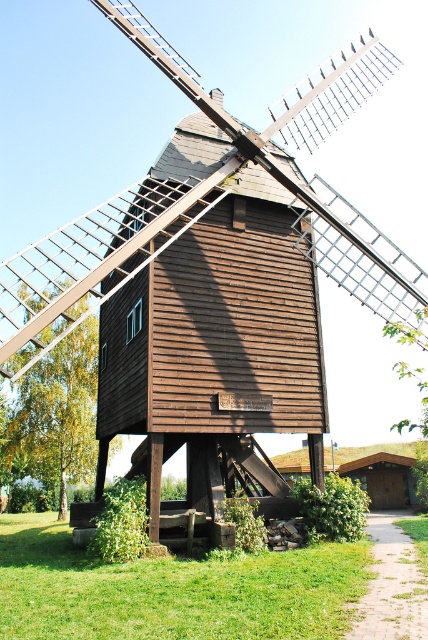
Question: Can you confirm if brown wooden hut at center is positioned above green grass at lower center?

Choices:
 (A) yes
 (B) no

Answer: (A)

Question: Observing the image, what is the correct spatial positioning of brown wooden windmill at center in reference to green grass at lower center?

Choices:
 (A) left
 (B) right

Answer: (B)

Question: Which object appears closest to the camera in this image?

Choices:
 (A) brown wooden windmill at center
 (B) brown wooden hut at center
 (C) brown wooden hut at lower right

Answer: (A)

Question: Does brown wooden windmill at center appear over brown wooden hut at lower right?

Choices:
 (A) yes
 (B) no

Answer: (A)

Question: Which point appears farthest from the camera in this image?

Choices:
 (A) (50, 515)
 (B) (152, 189)
 (C) (300, 273)

Answer: (A)

Question: Which of the following is the farthest from the observer?

Choices:
 (A) (137, 570)
 (B) (326, 81)
 (C) (397, 476)

Answer: (C)